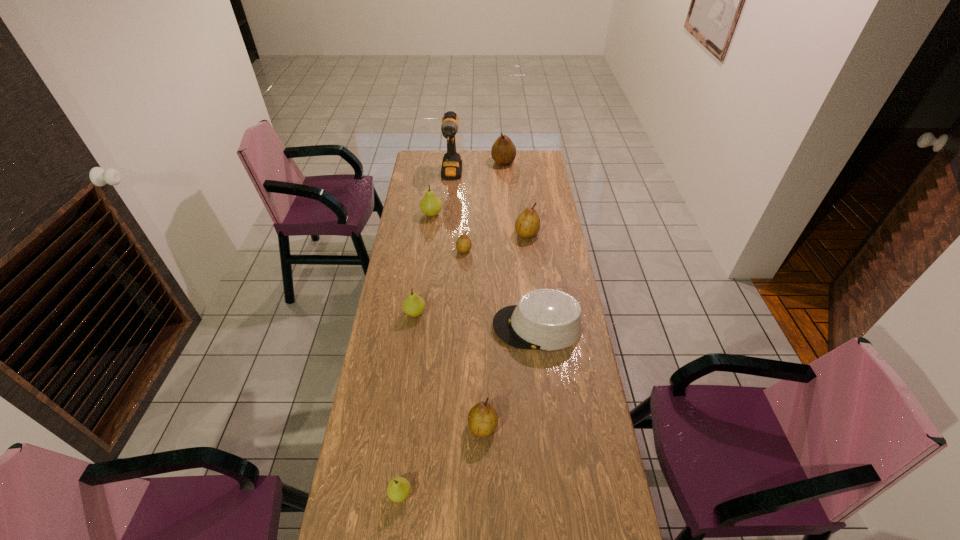
Locate an element on the screen. The height and width of the screenshot is (540, 960). drill is located at coordinates (451, 168).

Locate an element on the screen. The image size is (960, 540). the tallest pear is located at coordinates (503, 151).

I want to click on the second tallest object, so click(503, 151).

This screenshot has height=540, width=960. In order to click on the fifth nearest pear in this screenshot , I will do `click(527, 225)`.

Locate an element on the screen. The width and height of the screenshot is (960, 540). the third smallest brown pear is located at coordinates (527, 225).

At what (x,y) coordinates should I click in order to perform the action: click on the third farthest object. Please return your answer as a coordinate pair (x, y). Looking at the image, I should click on (430, 205).

Where is `the farthest green pear`? This screenshot has height=540, width=960. the farthest green pear is located at coordinates (430, 205).

You are a GUI agent. You are given a task and a screenshot of the screen. Output one action in this format:
    pyautogui.click(x=<x>, y=<y>)
    Task: Click on the second smallest green pear
    The width and height of the screenshot is (960, 540).
    Given the screenshot: What is the action you would take?
    pyautogui.click(x=413, y=305)

Image resolution: width=960 pixels, height=540 pixels. I want to click on the second farthest green pear, so click(413, 305).

You are a GUI agent. You are given a task and a screenshot of the screen. Output one action in this format:
    pyautogui.click(x=<x>, y=<y>)
    Task: Click on the nearest brown pear
    The width and height of the screenshot is (960, 540).
    Given the screenshot: What is the action you would take?
    pyautogui.click(x=482, y=419)